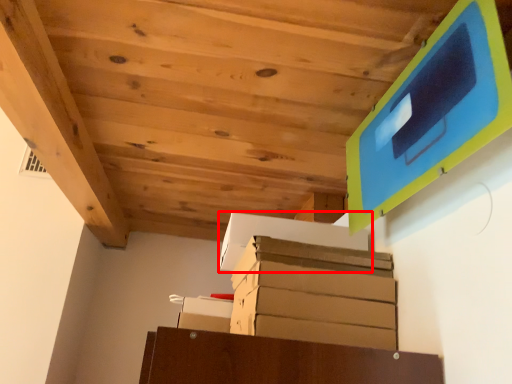
Question: From the image, what is the correct spatial relationship of cardboard box (annotated by the red box) in relation to cardboard box?

Choices:
 (A) right
 (B) left

Answer: (A)